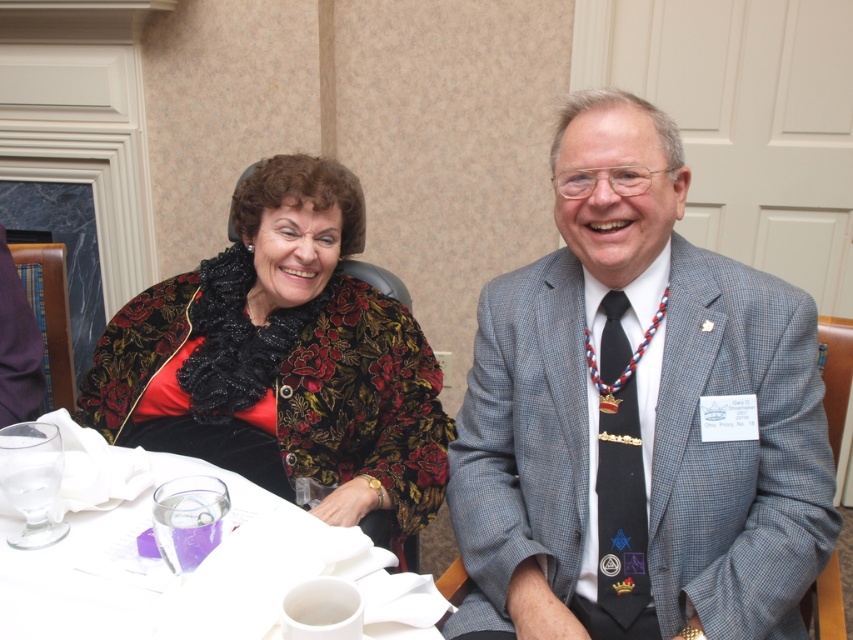
Which is behind, point (827, 515) or point (167, 465)?

Positioned behind is point (167, 465).

Between gray checkered suit at center and white paper napkin at lower left, which one is positioned higher?

gray checkered suit at center is higher up.

You are a GUI agent. You are given a task and a screenshot of the screen. Output one action in this format:
    pyautogui.click(x=<x>, y=<y>)
    Task: Click on the gray checkered suit at center
    This screenshot has width=853, height=640.
    Given the screenshot: What is the action you would take?
    pyautogui.click(x=636, y=417)

Is gray checkered suit at center closer to the viewer compared to floral velvet jacket at upper left?

Yes.

The height and width of the screenshot is (640, 853). Find the location of `gray checkered suit at center`. gray checkered suit at center is located at coordinates (636, 417).

Where is `gray checkered suit at center`? This screenshot has height=640, width=853. gray checkered suit at center is located at coordinates (636, 417).

Which of these two, floral velvet jacket at upper left or white paper napkin at lower left, stands shorter?

With less height is white paper napkin at lower left.

Measure the distance from floral velvet jacket at upper left to white paper napkin at lower left.

They are 34.76 centimeters apart.

Is point (395, 376) farther from camera compared to point (57, 557)?

Yes, it is.

Find the location of a particular element. This screenshot has width=853, height=640. floral velvet jacket at upper left is located at coordinates coord(281,358).